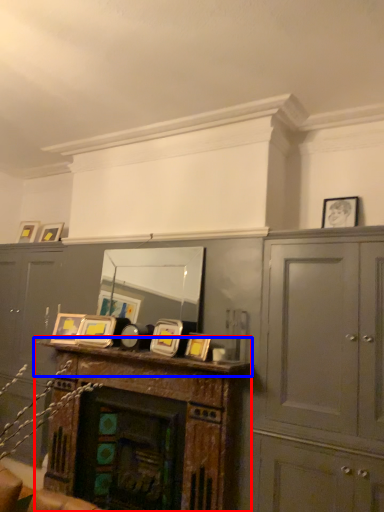
Question: Which point is further to the camera, table (highlighted by a red box) or mantle (highlighted by a blue box)?

Choices:
 (A) table
 (B) mantle

Answer: (A)